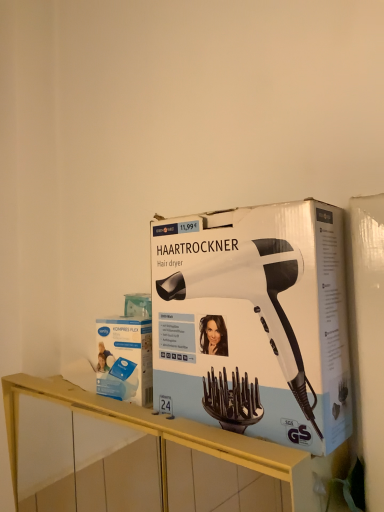
Identify the location of blue cardboard box at center. The image size is (384, 512). (125, 359).

Is white/black plastic hair dryer at center turned away from blue cardboard box at center?

No, blue cardboard box at center is not at the back of white/black plastic hair dryer at center.

Considering the points (285, 371) and (113, 334), which point is behind, point (285, 371) or point (113, 334)?

Point (113, 334)

Considering the relative sizes of white/black plastic hair dryer at center and blue cardboard box at center in the image provided, is white/black plastic hair dryer at center bigger than blue cardboard box at center?

Yes, white/black plastic hair dryer at center is bigger than blue cardboard box at center.

Is blue cardboard box at center surrounding yellow wood shelf at center?

No, yellow wood shelf at center is not a part of blue cardboard box at center.

Which object is further away from the camera taking this photo, blue cardboard box at center or yellow wood shelf at center?

blue cardboard box at center is more distant.

Between blue cardboard box at center and yellow wood shelf at center, which one appears on the left side from the viewer's perspective?

From the viewer's perspective, blue cardboard box at center appears more on the left side.

From the image's perspective, which object appears higher, blue cardboard box at center or white/black plastic hair dryer at center?

white/black plastic hair dryer at center.

Which of these two, blue cardboard box at center or white/black plastic hair dryer at center, is wider?

white/black plastic hair dryer at center.

Based on their sizes in the image, would you say blue cardboard box at center is bigger or smaller than white/black plastic hair dryer at center?

Clearly, blue cardboard box at center is smaller in size than white/black plastic hair dryer at center.

Locate an element on the screen. This screenshot has width=384, height=512. furniture on the left of white/black plastic hair dryer at center is located at coordinates (163, 436).

From the picture: Is yellow wood shelf at center inside or outside of white/black plastic hair dryer at center?

yellow wood shelf at center is located beyond the bounds of white/black plastic hair dryer at center.

Based on the photo, which object is wider, yellow wood shelf at center or white/black plastic hair dryer at center?

yellow wood shelf at center is wider.

Is point (273, 452) closer or farther from the camera than point (238, 281)?

Clearly, point (273, 452) is closer to the camera than point (238, 281).

Measure the distance between white/black plastic hair dryer at center and yellow wood shelf at center.

A distance of 7.05 inches exists between white/black plastic hair dryer at center and yellow wood shelf at center.

From their relative heights in the image, would you say white/black plastic hair dryer at center is taller or shorter than yellow wood shelf at center?

Considering their sizes, white/black plastic hair dryer at center has less height than yellow wood shelf at center.

Considering the relative positions of white/black plastic hair dryer at center and yellow wood shelf at center in the image provided, is white/black plastic hair dryer at center to the left or to the right of yellow wood shelf at center?

Clearly, white/black plastic hair dryer at center is on the right of yellow wood shelf at center in the image.

Is white/black plastic hair dryer at center bigger or smaller than yellow wood shelf at center?

In the image, white/black plastic hair dryer at center appears to be smaller than yellow wood shelf at center.

How different are the orientations of yellow wood shelf at center and blue cardboard box at center in degrees?

They differ by 0.514 degrees in their facing directions.

Image resolution: width=384 pixels, height=512 pixels. Identify the location of box above the yellow wood shelf at center (from the image's perspective). (125, 359).

Is yellow wood shelf at center turned away from blue cardboard box at center?

That's not correct — yellow wood shelf at center is not looking away from blue cardboard box at center.

Is yellow wood shelf at center not within blue cardboard box at center?

That's correct, yellow wood shelf at center is outside of blue cardboard box at center.

At what (x,y) coordinates should I click in order to perform the action: click on hair drier in front of the blue cardboard box at center. Please return your answer as a coordinate pair (x, y). This screenshot has height=512, width=384. Looking at the image, I should click on (254, 298).

I want to click on box behind the yellow wood shelf at center, so click(125, 359).

When comparing their distances from white/black plastic hair dryer at center, does blue cardboard box at center or yellow wood shelf at center seem closer?

blue cardboard box at center.

Which object lies nearer to the anchor point yellow wood shelf at center, blue cardboard box at center or white/black plastic hair dryer at center?

The object closer to yellow wood shelf at center is blue cardboard box at center.

Estimate the real-world distances between objects in this image. Which object is further from blue cardboard box at center, white/black plastic hair dryer at center or yellow wood shelf at center?

Among the two, white/black plastic hair dryer at center is located further to blue cardboard box at center.

When comparing their distances from blue cardboard box at center, does yellow wood shelf at center or white/black plastic hair dryer at center seem further?

Among the two, white/black plastic hair dryer at center is located further to blue cardboard box at center.

Based on their spatial positions, is yellow wood shelf at center or blue cardboard box at center closer to white/black plastic hair dryer at center?

blue cardboard box at center.

In the scene shown: From the image, which object appears to be farther from yellow wood shelf at center, white/black plastic hair dryer at center or blue cardboard box at center?

Based on the image, white/black plastic hair dryer at center appears to be further to yellow wood shelf at center.

Identify the location of box between white/black plastic hair dryer at center and yellow wood shelf at center in the vertical direction. The height and width of the screenshot is (512, 384). (125, 359).